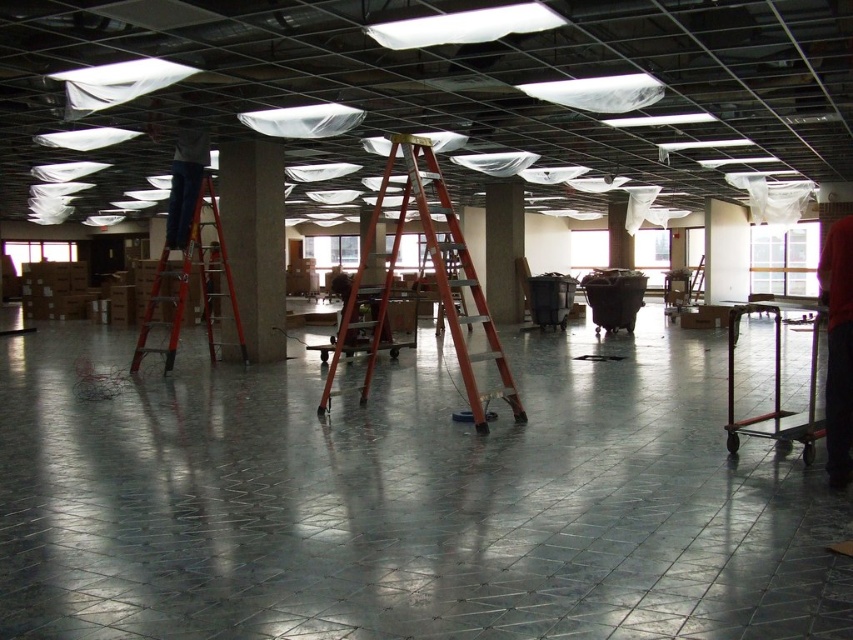
Can you confirm if concrete at center is wider than white glossy pillar at center?

Incorrect, concrete at center's width does not surpass white glossy pillar at center's.

Is point (252, 234) positioned in front of point (624, 216)?

That is True.

You are a GUI agent. You are given a task and a screenshot of the screen. Output one action in this format:
    pyautogui.click(x=<x>, y=<y>)
    Task: Click on the concrete at center
    Image resolution: width=853 pixels, height=640 pixels.
    Given the screenshot: What is the action you would take?
    pyautogui.click(x=254, y=241)

Which is above, concrete at center or metallic cart at center?

concrete at center is above.

Does concrete at center have a lesser width compared to metallic cart at center?

Yes.

Between point (236, 177) and point (776, 332), which one is positioned in front?

Point (236, 177) is more forward.

Locate an element on the screen. The image size is (853, 640). concrete at center is located at coordinates (254, 241).

Who is shorter, orange metallic ladder at center or concrete at center?

With less height is concrete at center.

Does point (474, 390) lie in front of point (248, 336)?

Yes, it is.

Where is `orange metallic ladder at center`? This screenshot has height=640, width=853. orange metallic ladder at center is located at coordinates (434, 278).